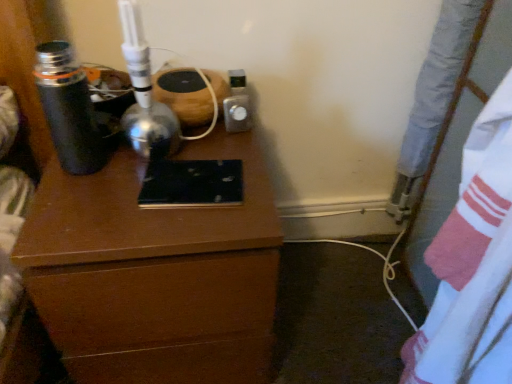
You are a GUI agent. You are given a task and a screenshot of the screen. Output one action in this format:
    pyautogui.click(x=<x>, y=<y>)
    Task: Click on the vacant space to the right of metallic silver thermos at left
    Image resolution: width=512 pixels, height=384 pixels.
    Given the screenshot: What is the action you would take?
    pyautogui.click(x=148, y=167)